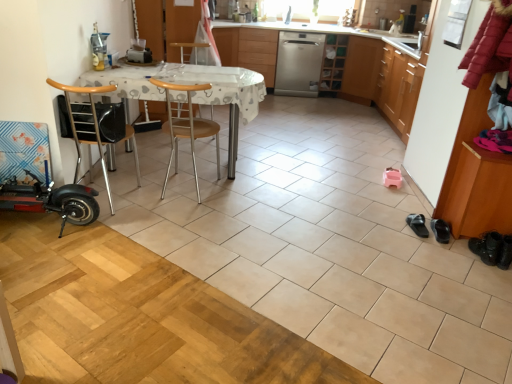
Question: Looking at their shapes, would you say white plastic table at center is wider or thinner than black leather shoe at lower right, marked as the 1th footwear in a left-to-right arrangement?

Choices:
 (A) thin
 (B) wide

Answer: (B)

Question: From a real-world perspective, is white plastic table at center physically located above or below black leather shoe at lower right, which is the third footwear from right to left?

Choices:
 (A) above
 (B) below

Answer: (A)

Question: Based on their relative distances, which object is nearer to the wooden chair at left, the first chair positioned from the left?

Choices:
 (A) wooden at center, the 2th chair in the left-to-right sequence
 (B) white plastic table at center
 (C) satin silver dishwasher at center
 (D) black leather shoe at lower right, which is the third footwear from right to left
 (E) brown wood shoe rack at right, the second cabinetry when ordered from back to front

Answer: (A)

Question: Which is farther from the silver metallic dishwasher at center, acting as the second cabinetry starting from the front?

Choices:
 (A) wooden at center, the first chair viewed from the right
 (B) black leather boots at lower right, the 1th footwear in the right-to-left sequence
 (C) wooden chair at left, the first chair positioned from the left
 (D) satin silver dishwasher at center
 (E) black leather shoe at lower right, marked as the 1th footwear in a left-to-right arrangement

Answer: (B)